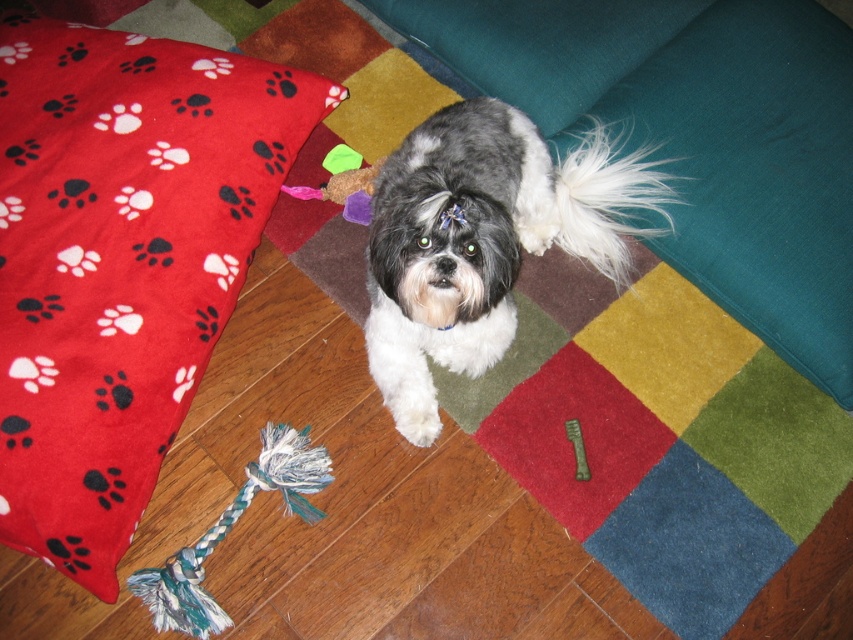
Question: Is multicolored felt mat at center below multicolored braided rope at lower left?

Choices:
 (A) no
 (B) yes

Answer: (A)

Question: Does red fleece throw pillow at lower left have a smaller size compared to green metallic comb at lower center?

Choices:
 (A) no
 (B) yes

Answer: (A)

Question: Considering the real-world distances, which object is closest to the green metallic comb at lower center?

Choices:
 (A) black and white fur at center
 (B) red fleece throw pillow at lower left
 (C) white fluffy tail at upper center

Answer: (C)

Question: Can you confirm if multicolored felt mat at center is positioned to the right of white fluffy tail at upper center?

Choices:
 (A) no
 (B) yes

Answer: (A)

Question: Which object appears closest to the camera in this image?

Choices:
 (A) red fleece throw pillow at lower left
 (B) white fluffy tail at upper center

Answer: (A)

Question: Based on their relative distances, which object is farther from the multicolored braided rope at lower left?

Choices:
 (A) white fluffy tail at upper center
 (B) multicolored felt mat at center
 (C) black and white fur at center

Answer: (A)